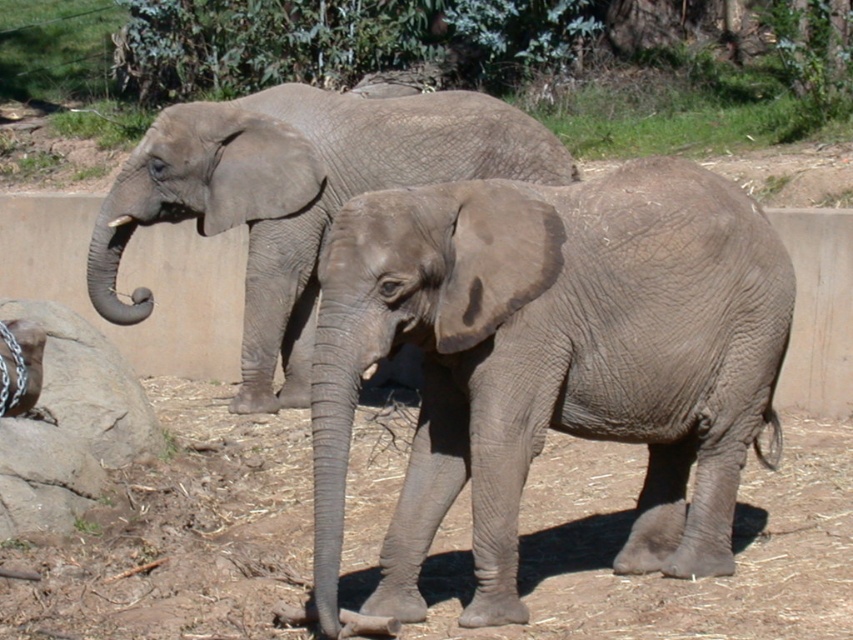
Question: Is gray matte elephant at center positioned in front of brown dirt at lower center?

Choices:
 (A) no
 (B) yes

Answer: (B)

Question: Does gray matte elephant at center appear on the right side of brown dirt at lower center?

Choices:
 (A) yes
 (B) no

Answer: (A)

Question: Which point appears closest to the camera in this image?

Choices:
 (A) (767, 500)
 (B) (540, 188)

Answer: (B)

Question: Estimate the real-world distances between objects in this image. Which object is closer to the gray matte elephant at center?

Choices:
 (A) brown dirt at lower center
 (B) gray matte elephant at upper left

Answer: (A)

Question: Does gray matte elephant at center come behind brown dirt at lower center?

Choices:
 (A) yes
 (B) no

Answer: (B)

Question: Which of the following is the farthest from the observer?

Choices:
 (A) (550, 193)
 (B) (460, 500)
 (C) (316, 145)

Answer: (C)